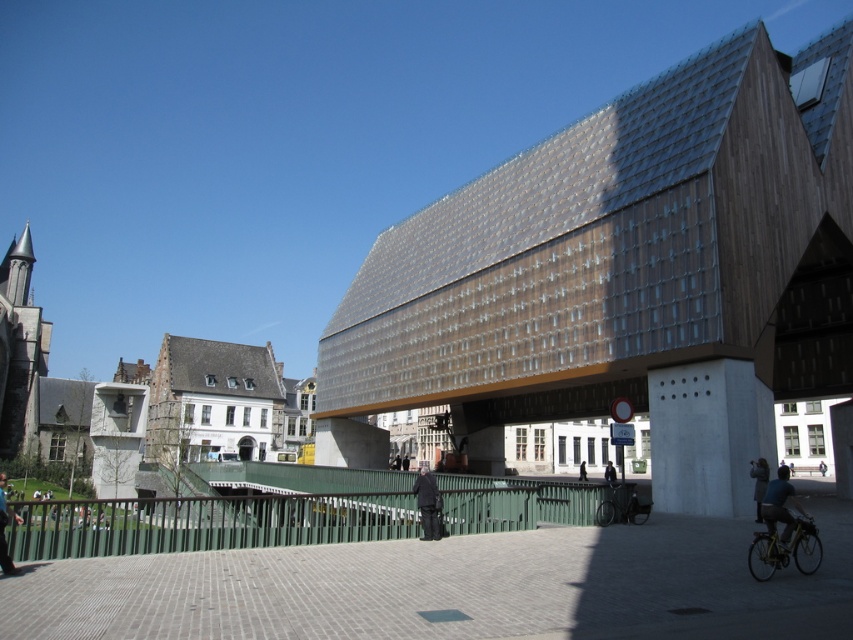
Question: Considering the real-world distances, which object is farthest from the shiny metallic bicycle at lower right?

Choices:
 (A) black matte bicycle at center
 (B) dark blue jeans at lower right
 (C) dark gray jacket at center
 (D) wooden slatted roof at center

Answer: (C)

Question: In this image, where is dark gray jacket at lower left located relative to dark blue jacket at center?

Choices:
 (A) below
 (B) above

Answer: (B)

Question: Estimate the real-world distances between objects in this image. Which object is farther from the dark gray coat at center?

Choices:
 (A) black matte bicycle at center
 (B) dark gray jacket at center
 (C) dark gray jacket at lower left
 (D) dark gray suit at center

Answer: (C)

Question: Which object is positioned closest to the shiny metallic bicycle at lower right?

Choices:
 (A) dark gray coat at center
 (B) dark blue jeans at lower right
 (C) black matte bicycle at center

Answer: (B)

Question: Does black matte bicycle at center have a greater width compared to dark gray jacket at center?

Choices:
 (A) yes
 (B) no

Answer: (B)

Question: Does dark gray suit at center appear on the right side of dark gray coat at center?

Choices:
 (A) no
 (B) yes

Answer: (A)